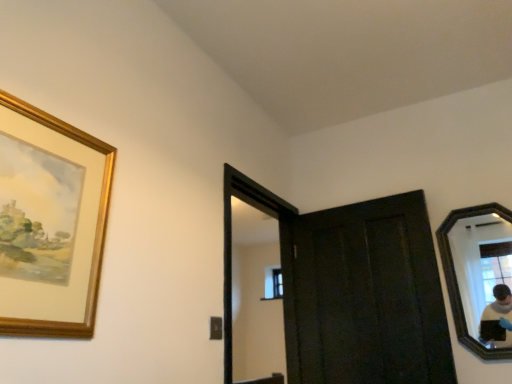
Question: Is dark wood door at center far from clear glass window at center?

Choices:
 (A) yes
 (B) no

Answer: (A)

Question: From a real-world perspective, is dark wood door at center beneath clear glass window at center?

Choices:
 (A) yes
 (B) no

Answer: (A)

Question: Would you say dark wood door at center contains clear glass window at center?

Choices:
 (A) no
 (B) yes

Answer: (A)

Question: From the image's perspective, is dark wood door at center under clear glass window at center?

Choices:
 (A) no
 (B) yes

Answer: (A)

Question: Can you confirm if dark wood door at center is positioned to the right of clear glass window at center?

Choices:
 (A) yes
 (B) no

Answer: (A)

Question: Would you say black wooden mirror at right is inside or outside gold-framed painting at upper left?

Choices:
 (A) outside
 (B) inside

Answer: (A)

Question: Looking at the image, does black wooden mirror at right seem bigger or smaller compared to gold-framed painting at upper left?

Choices:
 (A) small
 (B) big

Answer: (B)

Question: Considering the positions of black wooden mirror at right and gold-framed painting at upper left in the image, is black wooden mirror at right taller or shorter than gold-framed painting at upper left?

Choices:
 (A) short
 (B) tall

Answer: (B)

Question: From a real-world perspective, is black wooden mirror at right physically located above or below gold-framed painting at upper left?

Choices:
 (A) below
 (B) above

Answer: (A)

Question: From a real-world perspective, is dark wood door at center above or below black wooden mirror at right?

Choices:
 (A) below
 (B) above

Answer: (A)

Question: From the image's perspective, is dark wood door at center located above or below black wooden mirror at right?

Choices:
 (A) above
 (B) below

Answer: (B)

Question: Is dark wood door at center inside or outside of black wooden mirror at right?

Choices:
 (A) inside
 (B) outside

Answer: (B)

Question: Visually, is dark wood door at center positioned to the left or to the right of black wooden mirror at right?

Choices:
 (A) left
 (B) right

Answer: (A)

Question: In the image, is dark wood door at center positioned in front of or behind gold-framed painting at upper left?

Choices:
 (A) behind
 (B) front

Answer: (A)

Question: From the image's perspective, is dark wood door at center located above or below gold-framed painting at upper left?

Choices:
 (A) above
 (B) below

Answer: (B)